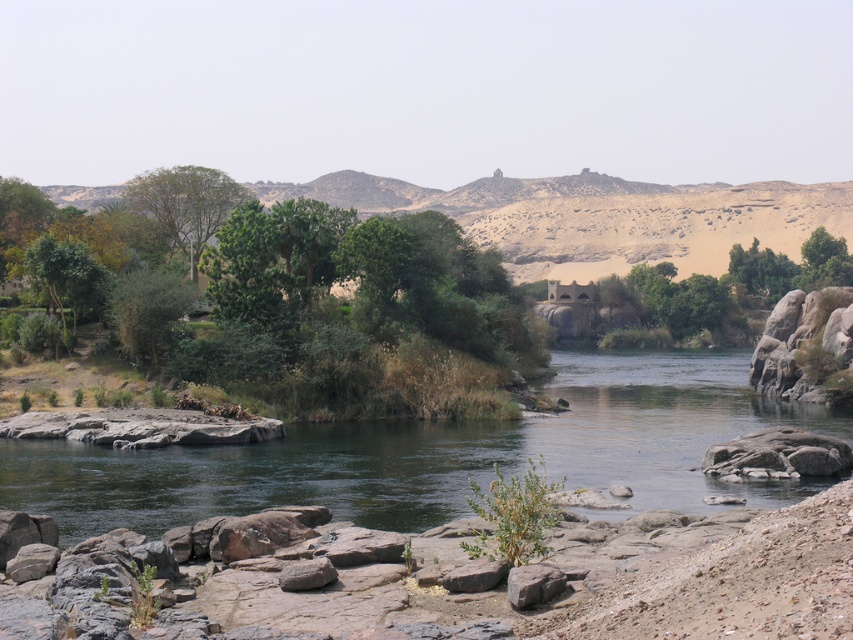
Which of these two, greenish-brown rock at center or gray rough rock at center, stands shorter?

Standing shorter between the two is gray rough rock at center.

Who is higher up, greenish-brown rock at center or gray rough rock at center?

greenish-brown rock at center

Does point (252, 449) come farther from viewer compared to point (531, 573)?

Yes, point (252, 449) is farther from viewer.

Where is `greenish-brown rock at center`? This screenshot has height=640, width=853. greenish-brown rock at center is located at coordinates (434, 454).

Is green leafy tree at left to the left of rusty metallic rock at lower center from the viewer's perspective?

Yes, green leafy tree at left is to the left of rusty metallic rock at lower center.

I want to click on green leafy tree at left, so [x=67, y=275].

Locate an element on the screen. green leafy tree at left is located at coordinates (67, 275).

Does green leafy tree at left appear under gray rough rock at center?

Actually, green leafy tree at left is above gray rough rock at center.

Can you confirm if green leafy tree at left is wider than gray rough rock at center?

No, green leafy tree at left is not wider than gray rough rock at center.

Find the location of a particular element. This screenshot has width=853, height=640. green leafy tree at left is located at coordinates (67, 275).